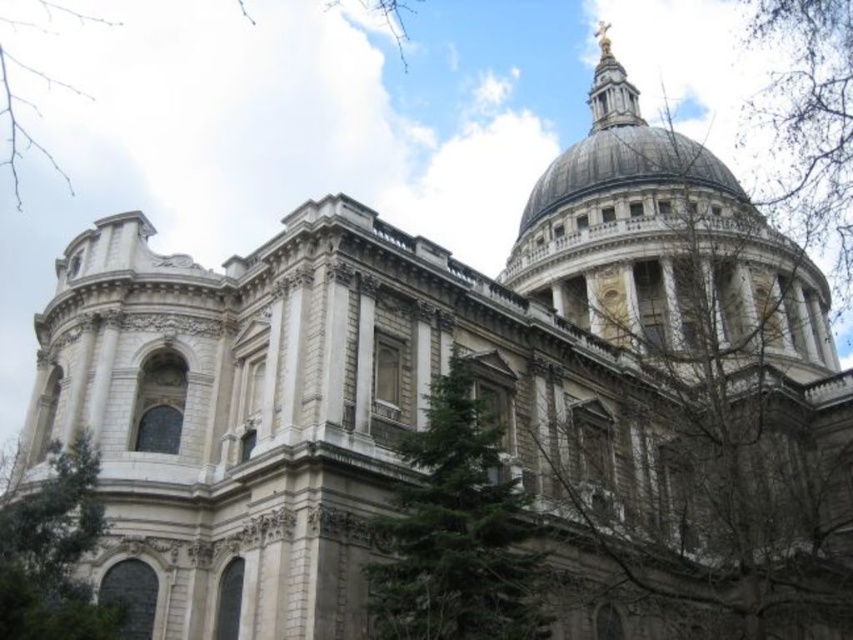
Question: Can you confirm if bare branches at upper right is positioned above green leafy tree at lower left?

Choices:
 (A) no
 (B) yes

Answer: (B)

Question: Is bare branches at upper right above green leafy tree at lower left?

Choices:
 (A) no
 (B) yes

Answer: (B)

Question: Among these objects, which one is farthest from the camera?

Choices:
 (A) bare branches at upper right
 (B) green leafy tree at upper center
 (C) green leafy tree at lower left

Answer: (B)

Question: Which of the following is the closest to the observer?

Choices:
 (A) (61, 556)
 (B) (793, 232)
 (C) (16, 147)
 (D) (381, 532)

Answer: (A)

Question: Which is nearer to the green leafy tree at upper center?

Choices:
 (A) green textured tree at center
 (B) bare branches at upper right
 (C) green leafy tree at lower left

Answer: (B)

Question: Can you confirm if bare branches at upper right is thinner than green leafy tree at lower left?

Choices:
 (A) no
 (B) yes

Answer: (A)